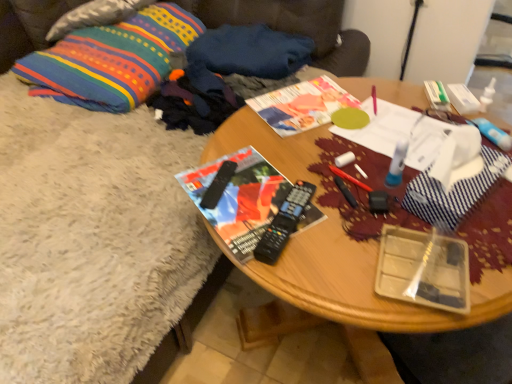
Question: From a real-world perspective, is multicolored woven pillow at upper left, positioned as the 1th pillow in bottom-to-top order, beneath dark blue fabric at upper center, the 1th clothing when ordered from back to front?

Choices:
 (A) yes
 (B) no

Answer: (A)

Question: Is multicolored woven pillow at upper left, the second pillow from the top, directly adjacent to dark blue fabric at upper center, the 1th clothing when ordered from back to front?

Choices:
 (A) yes
 (B) no

Answer: (B)

Question: Is the position of multicolored woven pillow at upper left, positioned as the 1th pillow in bottom-to-top order, more distant than that of dark blue fabric at upper center, which is the second clothing in front-to-back order?

Choices:
 (A) no
 (B) yes

Answer: (A)

Question: Is multicolored woven pillow at upper left, positioned as the 1th pillow in bottom-to-top order, not within dark blue fabric at upper center, the 1th clothing when ordered from back to front?

Choices:
 (A) yes
 (B) no

Answer: (A)

Question: Does multicolored woven pillow at upper left, positioned as the 1th pillow in bottom-to-top order, have a lesser height compared to dark blue fabric at upper center, the 1th clothing when ordered from back to front?

Choices:
 (A) yes
 (B) no

Answer: (B)

Question: From the image's perspective, is multicolored woven pillow at upper left, positioned as the 1th pillow in bottom-to-top order, located above dark blue fabric at upper center, which is the second clothing in front-to-back order?

Choices:
 (A) no
 (B) yes

Answer: (B)

Question: Is matte paper magazine at center completely or partially inside black plastic remote control at center, the 1th remote control positioned from the left?

Choices:
 (A) no
 (B) yes

Answer: (A)

Question: Is black plastic remote control at center, the 1th remote control positioned from the left, aimed at matte paper magazine at center?

Choices:
 (A) yes
 (B) no

Answer: (A)

Question: From the image's perspective, is black plastic remote control at center, the 1th remote control positioned from the left, located beneath matte paper magazine at center?

Choices:
 (A) yes
 (B) no

Answer: (A)

Question: Is black plastic remote control at center, which is the 2th remote control in right-to-left order, closer to camera compared to matte paper magazine at center?

Choices:
 (A) yes
 (B) no

Answer: (A)

Question: Considering the relative sizes of black plastic remote control at center, which is the 2th remote control in right-to-left order, and matte paper magazine at center in the image provided, is black plastic remote control at center, which is the 2th remote control in right-to-left order, thinner than matte paper magazine at center?

Choices:
 (A) yes
 (B) no

Answer: (A)

Question: Is matte paper magazine at center at the back of black plastic remote control at center, the 1th remote control positioned from the left?

Choices:
 (A) no
 (B) yes

Answer: (A)

Question: Can you confirm if wooden table at center is positioned to the left of matte black magazine at center?

Choices:
 (A) no
 (B) yes

Answer: (A)